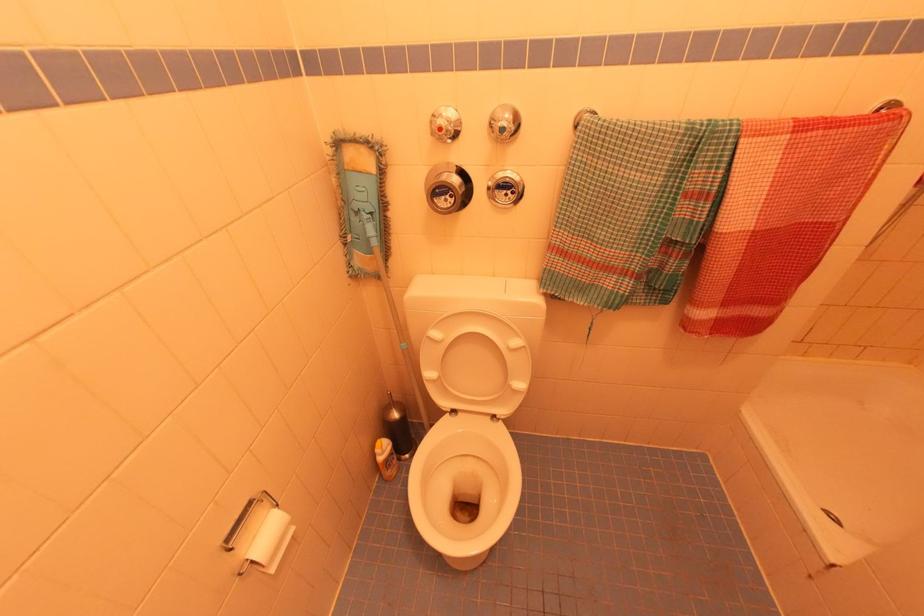
This screenshot has width=924, height=616. Describe the element at coordinates (797, 122) in the screenshot. I see `a metal towel bar` at that location.